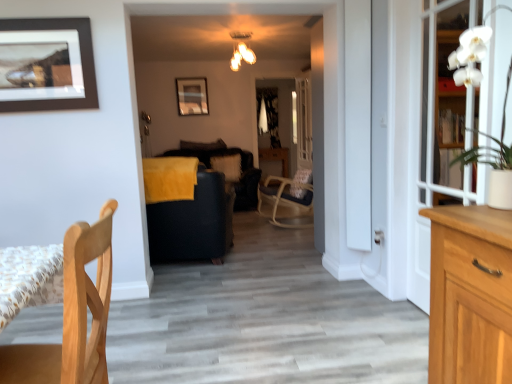
Locate an element on the screen. free space above metallic glass chandelier at upper center (from a real-world perspective) is located at coordinates (242, 31).